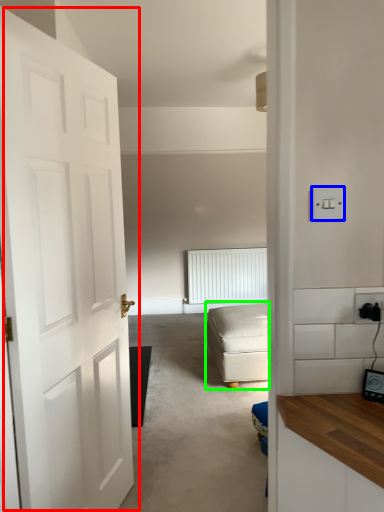
Question: Based on their relative distances, which object is nearer to door (highlighted by a red box)? Choose from light switch (highlighted by a blue box) and studio couch (highlighted by a green box).

Choices:
 (A) light switch
 (B) studio couch

Answer: (A)